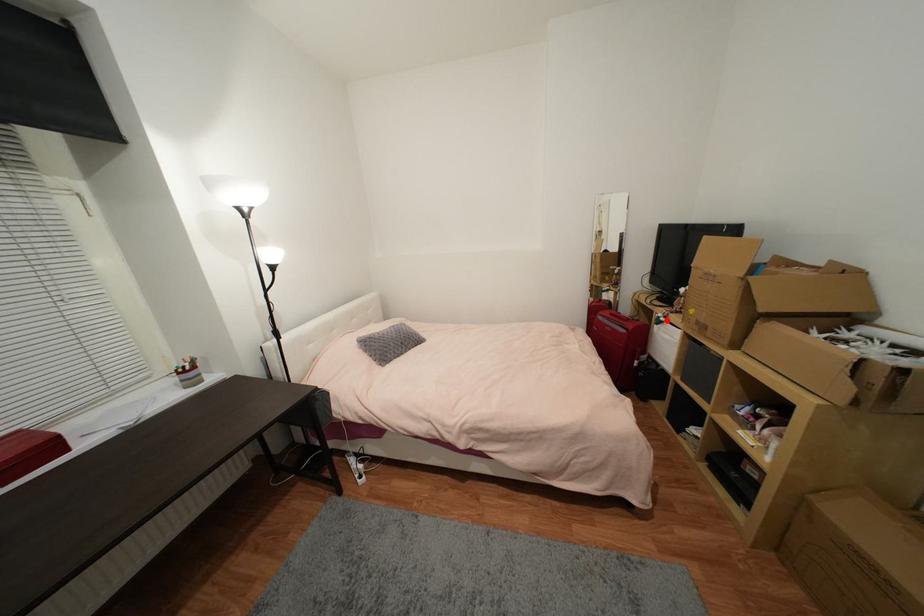
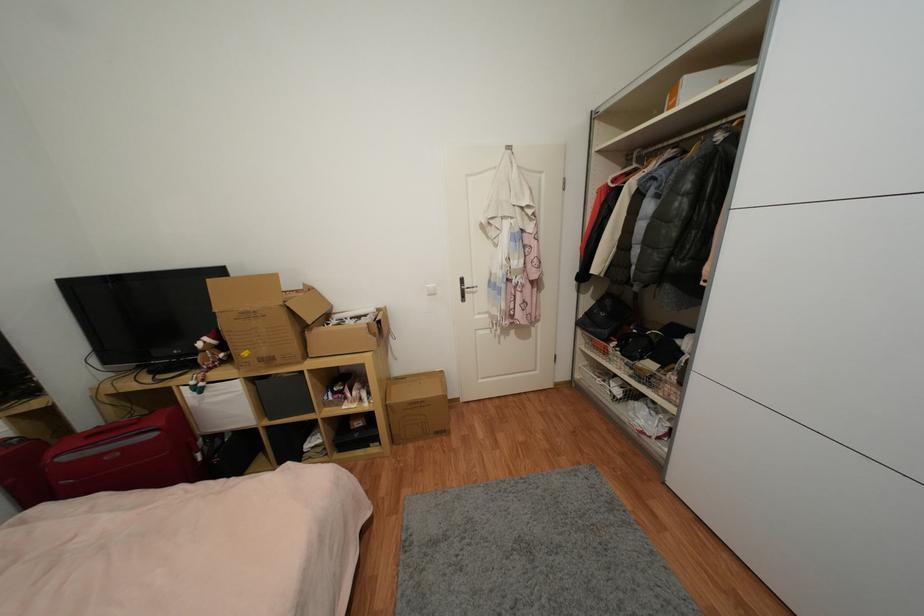
Question: A red point is marked in image1. In image2, is the corresponding 3D point closer to the camera or farther? Reply with the corresponding letter.

Choices:
 (A) The corresponding 3D point is closer.
 (B) The corresponding 3D point is farther.

Answer: (B)